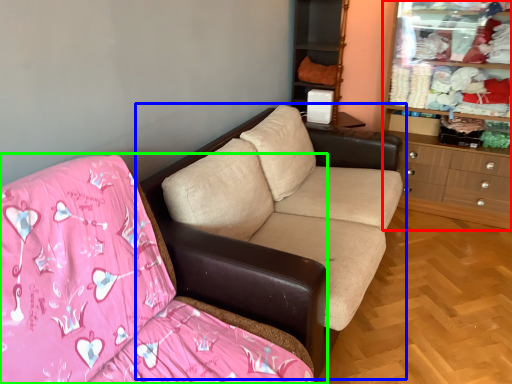
Question: Based on their relative distances, which object is farther from dresser (highlighted by a red box)? Choose from studio couch (highlighted by a blue box) and studio couch (highlighted by a green box).

Choices:
 (A) studio couch
 (B) studio couch

Answer: (B)